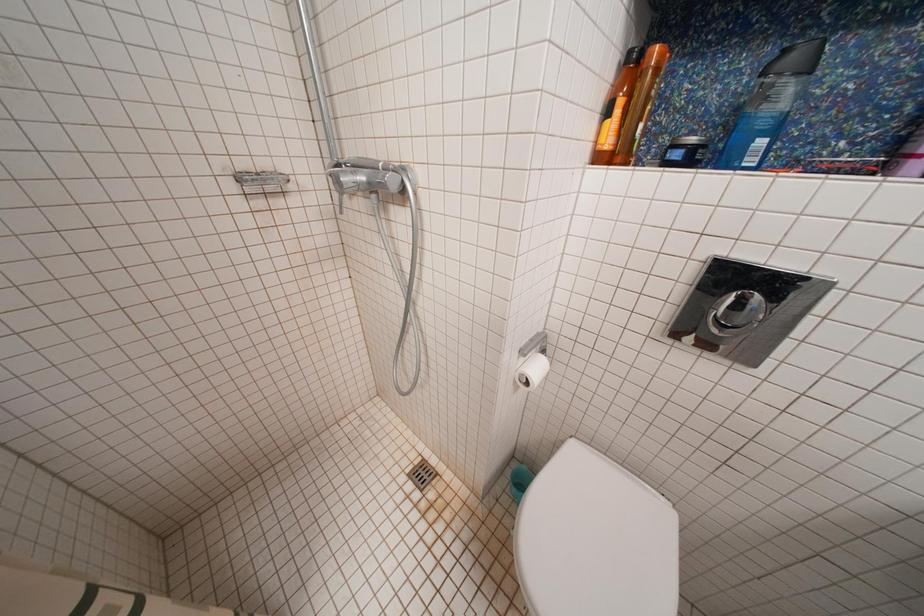
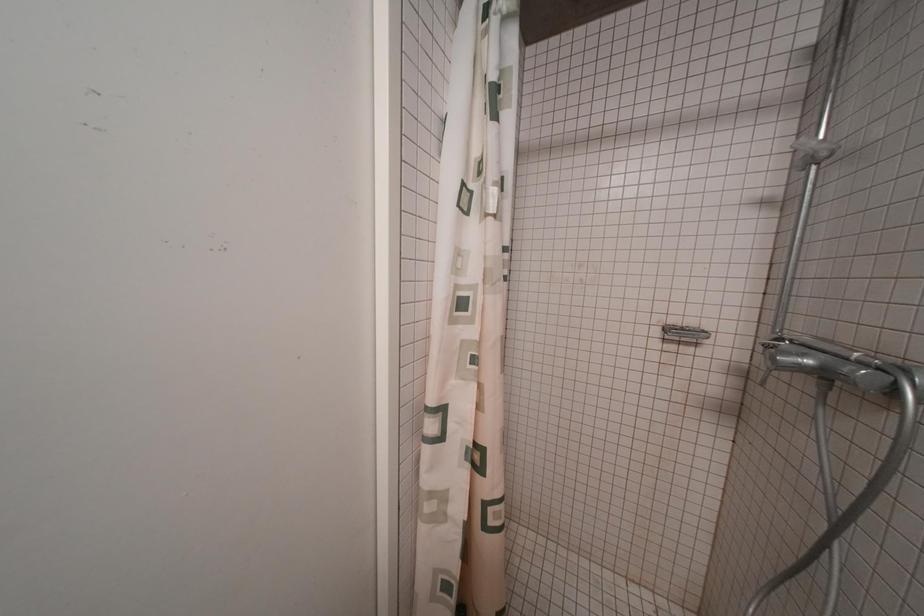
Question: Based on the continuous images, in which direction is the camera rotating? Reply with the corresponding letter.

Choices:
 (A) Left
 (B) Right
 (C) Up
 (D) Down

Answer: (A)